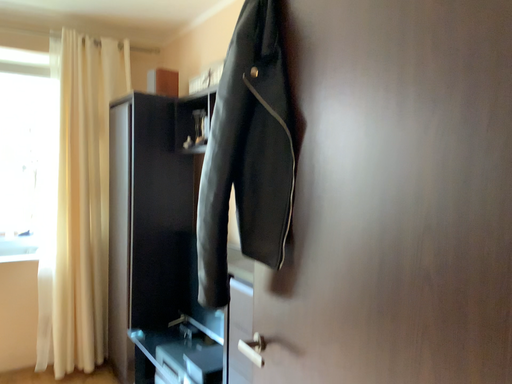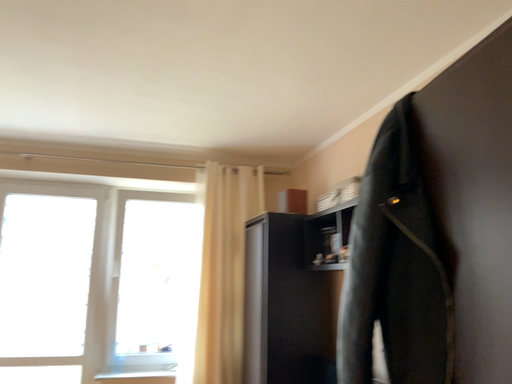
Question: How did the camera likely rotate when shooting the video?

Choices:
 (A) rotated downward
 (B) rotated upward

Answer: (B)